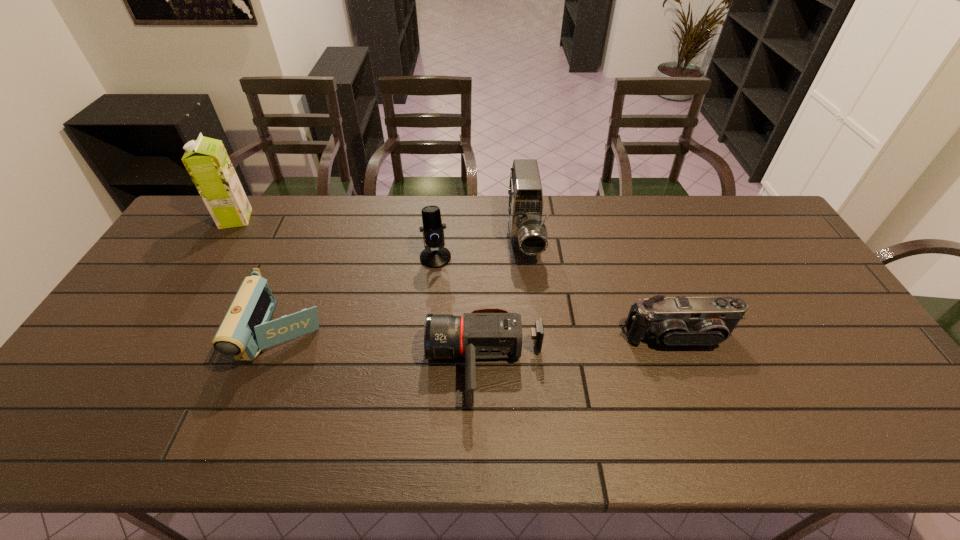
Find the location of a particular element. The height and width of the screenshot is (540, 960). soya milk is located at coordinates (206, 160).

Locate an element on the screen. The image size is (960, 540). the tallest object is located at coordinates (206, 160).

The height and width of the screenshot is (540, 960). Identify the location of the farthest camcorder. (528, 233).

This screenshot has width=960, height=540. I want to click on the fifth shortest object, so click(x=528, y=233).

Identify the location of the third tallest object. The width and height of the screenshot is (960, 540). (435, 255).

Identify the location of the leftmost camcorder. (246, 329).

The image size is (960, 540). Identify the location of the rightmost camcorder. click(700, 321).

What are the coordinates of `the shortest object` in the screenshot? It's located at (488, 333).

You are a GUI agent. You are given a task and a screenshot of the screen. Output one action in this format:
    pyautogui.click(x=<x>, y=<y>)
    Task: Click on the free space located on the right of the leftmost object
    This screenshot has width=960, height=540.
    Given the screenshot: What is the action you would take?
    pyautogui.click(x=306, y=219)

Find the location of `vacant position located at the front of the farthest camcorder, highlighting the lens`. vacant position located at the front of the farthest camcorder, highlighting the lens is located at coordinates (533, 323).